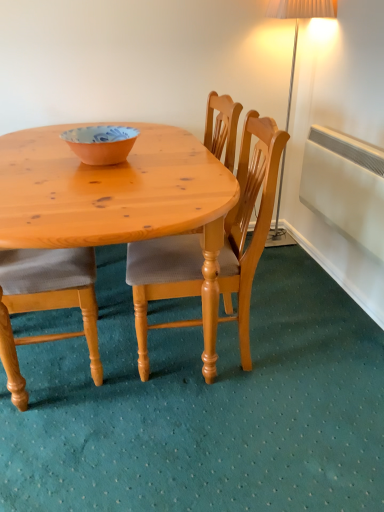
Where is `free area below light brown wooden chair at center (from a real-world perspective)`? This screenshot has height=512, width=384. free area below light brown wooden chair at center (from a real-world perspective) is located at coordinates (217, 354).